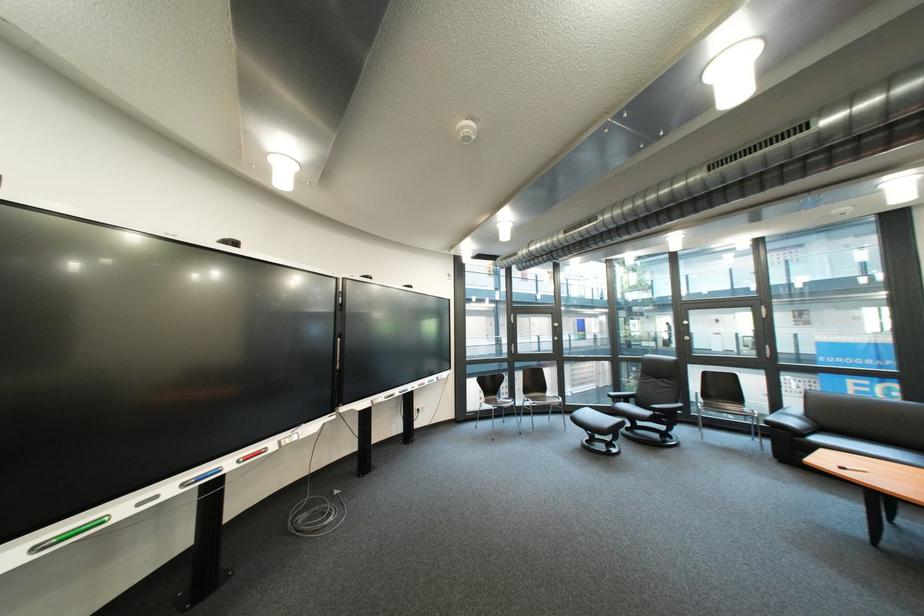
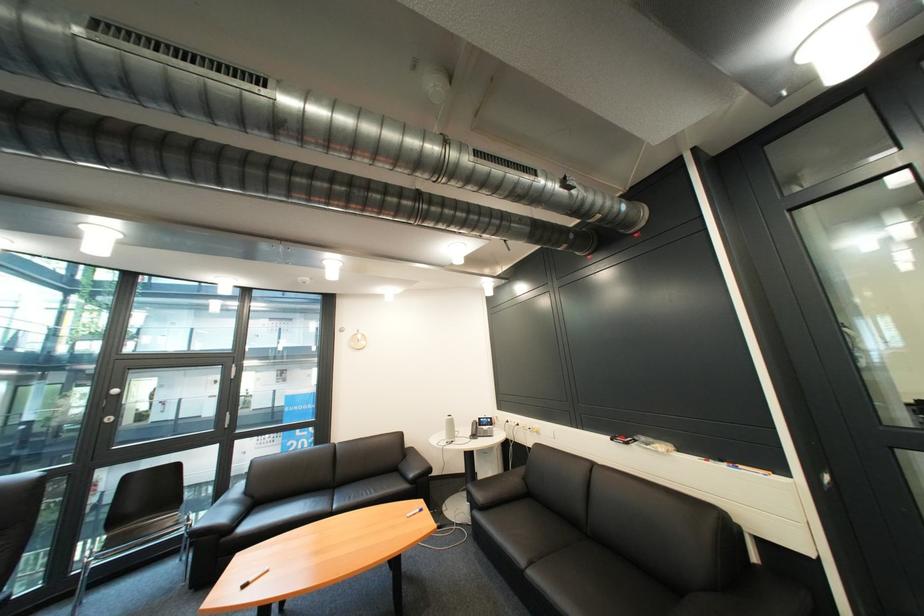
Where in the second image is the point corresponding to point 696,331 from the first image?

(118, 408)